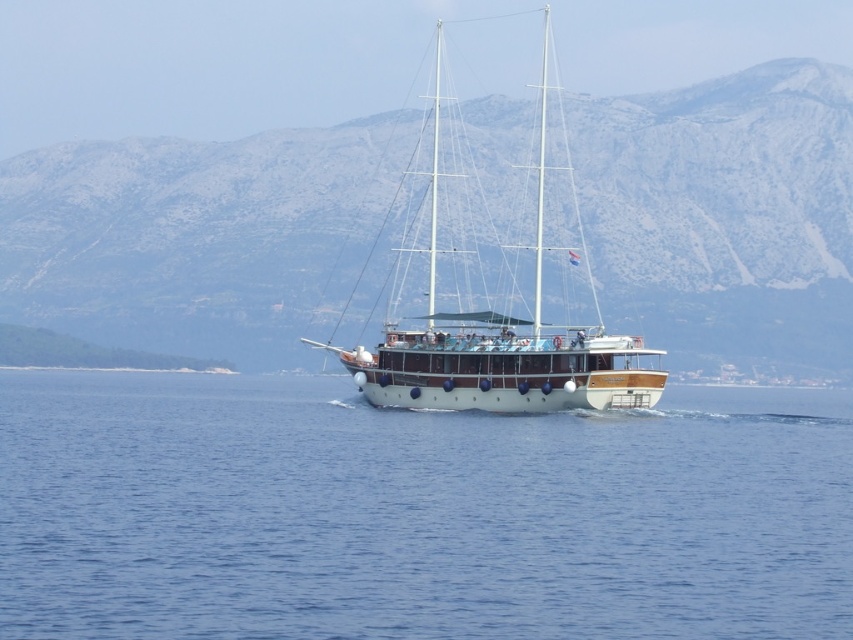
Question: Among these points, which one is nearest to the camera?

Choices:
 (A) (604, 132)
 (B) (659, 436)
 (C) (544, 58)

Answer: (B)

Question: Estimate the real-world distances between objects in this image. Which object is closer to the blue water at center?

Choices:
 (A) gray rocky mountain at center
 (B) white polished wood sailboat at center

Answer: (B)

Question: In this image, where is blue water at center located relative to white polished wood sailboat at center?

Choices:
 (A) above
 (B) below

Answer: (B)

Question: Considering the relative positions of blue water at center and gray rocky mountain at center in the image provided, where is blue water at center located with respect to gray rocky mountain at center?

Choices:
 (A) above
 (B) below

Answer: (B)

Question: Is blue water at center further to the viewer compared to white polished wood sailboat at center?

Choices:
 (A) yes
 (B) no

Answer: (B)

Question: Which of the following is the farthest from the observer?

Choices:
 (A) white polished wood sailboat at center
 (B) blue water at center
 (C) gray rocky mountain at center

Answer: (C)